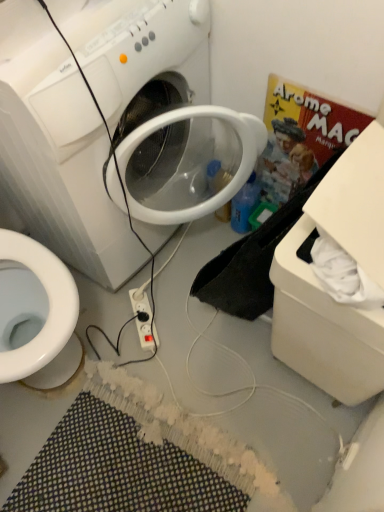
Where is `vacant area located to the right-hand side of white plastic power outlet at center`? vacant area located to the right-hand side of white plastic power outlet at center is located at coordinates (190, 322).